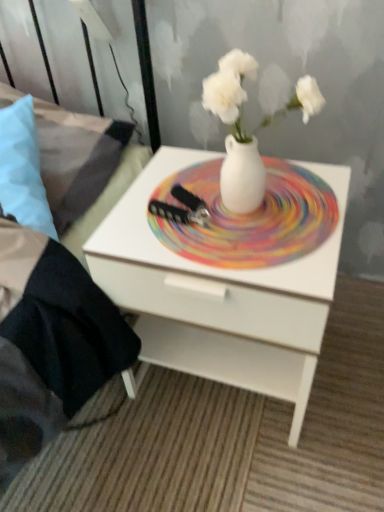
Image resolution: width=384 pixels, height=512 pixels. I want to click on white glossy nightstand at center, so click(x=219, y=296).

Locate an element on the screen. white matte vase at center is located at coordinates (236, 133).

The image size is (384, 512). What do you see at coordinates (236, 133) in the screenshot?
I see `white matte vase at center` at bounding box center [236, 133].

Describe the element at coordinates (250, 218) in the screenshot. The height and width of the screenshot is (512, 384). I see `white glossy plate at center` at that location.

The image size is (384, 512). Describe the element at coordinates (81, 172) in the screenshot. I see `brushed metal bed frame at left` at that location.

This screenshot has width=384, height=512. Identify the location of light blue fabric pillow at left. (23, 169).

In terms of width, does white matte vase at center look wider or thinner when compared to brushed metal bed frame at left?

white matte vase at center is thinner than brushed metal bed frame at left.

Looking at the image, does white matte vase at center seem bigger or smaller compared to brushed metal bed frame at left?

Considering their sizes, white matte vase at center takes up less space than brushed metal bed frame at left.

From a real-world perspective, is white matte vase at center located higher than brushed metal bed frame at left?

Yes, from a real-world perspective, white matte vase at center is above brushed metal bed frame at left.

Who is shorter, white matte vase at center or brushed metal bed frame at left?

With less height is white matte vase at center.

From their relative heights in the image, would you say brushed metal bed frame at left is taller or shorter than light blue fabric pillow at left?

brushed metal bed frame at left is taller than light blue fabric pillow at left.

Does brushed metal bed frame at left have a lesser width compared to light blue fabric pillow at left?

No.

From the image's perspective, relative to light blue fabric pillow at left, is brushed metal bed frame at left above or below?

Clearly, from the image's perspective, brushed metal bed frame at left is above light blue fabric pillow at left.

Is light blue fabric pillow at left surrounded by brushed metal bed frame at left?

Yes, light blue fabric pillow at left is a part of brushed metal bed frame at left.

Is white glossy plate at center at the back of white matte vase at center?

That's not correct — white matte vase at center is not looking away from white glossy plate at center.

From the image's perspective, is white matte vase at center positioned above or below white glossy plate at center?

white matte vase at center is above white glossy plate at center.

Can you tell me how much white matte vase at center and white glossy plate at center differ in facing direction?

The facing directions of white matte vase at center and white glossy plate at center are 1.07 degrees apart.

Which of these two, white glossy plate at center or white matte vase at center, stands shorter?

Standing shorter between the two is white glossy plate at center.

Looking at this image, between white glossy plate at center and white matte vase at center, which one has larger size?

white matte vase at center.

In terms of width, does white glossy plate at center look wider or thinner when compared to white matte vase at center?

In the image, white glossy plate at center appears to be wider than white matte vase at center.

Find the location of a particular element. This screenshot has height=512, width=384. plate on the left of white matte vase at center is located at coordinates (250, 218).

Is light blue fabric pillow at left oriented towards white glossy plate at center?

No.

Which object is thinner, light blue fabric pillow at left or white glossy plate at center?

Thinner between the two is light blue fabric pillow at left.

Which of these two, light blue fabric pillow at left or white glossy plate at center, is bigger?

With larger size is light blue fabric pillow at left.

Would you say light blue fabric pillow at left is inside or outside white glossy plate at center?

light blue fabric pillow at left exists outside the volume of white glossy plate at center.

Is brushed metal bed frame at left in front of or behind white glossy plate at center in the image?

brushed metal bed frame at left is positioned closer to the viewer than white glossy plate at center.

Which of these two, brushed metal bed frame at left or white glossy plate at center, stands shorter?

white glossy plate at center.

Can you tell me how much brushed metal bed frame at left and white glossy plate at center differ in facing direction?

The angle between the facing direction of brushed metal bed frame at left and the facing direction of white glossy plate at center is 4.67 degrees.

Identify the location of bed frame on the left of the white glossy plate at center. (81, 172).

How different are the orientations of white glossy nightstand at center and brushed metal bed frame at left in degrees?

The angular difference between white glossy nightstand at center and brushed metal bed frame at left is 4.67 degrees.

Can you confirm if white glossy nightstand at center is shorter than brushed metal bed frame at left?

In fact, white glossy nightstand at center may be taller than brushed metal bed frame at left.

Is there a large distance between white glossy nightstand at center and brushed metal bed frame at left?

Actually, white glossy nightstand at center and brushed metal bed frame at left are a little close together.

From a real-world perspective, is white glossy nightstand at center above or below brushed metal bed frame at left?

white glossy nightstand at center is situated lower than brushed metal bed frame at left in the real world.

Find the location of `floral arrangement that appears above the brushed metal bed frame at left (from a real-world perspective)`. floral arrangement that appears above the brushed metal bed frame at left (from a real-world perspective) is located at coordinates (236, 133).

Locate an element on the screen. Image resolution: width=384 pixels, height=512 pixels. bed frame in front of the light blue fabric pillow at left is located at coordinates (81, 172).

From the image, which object appears to be nearer to brushed metal bed frame at left, light blue fabric pillow at left or white glossy nightstand at center?

light blue fabric pillow at left is positioned closer to the anchor brushed metal bed frame at left.

Which object lies nearer to the anchor point white glossy nightstand at center, white glossy plate at center or brushed metal bed frame at left?

white glossy plate at center lies closer to white glossy nightstand at center than the other object.

Based on the photo, estimate the real-world distances between objects in this image. Which object is further from white glossy nightstand at center, brushed metal bed frame at left or white glossy plate at center?

Among the two, brushed metal bed frame at left is located further to white glossy nightstand at center.

Estimate the real-world distances between objects in this image. Which object is further from white glossy plate at center, brushed metal bed frame at left or light blue fabric pillow at left?

light blue fabric pillow at left is further to white glossy plate at center.

Based on their spatial positions, is white glossy plate at center or white matte vase at center closer to white glossy nightstand at center?

Based on the image, white glossy plate at center appears to be nearer to white glossy nightstand at center.

Which object lies nearer to the anchor point brushed metal bed frame at left, white glossy nightstand at center or white glossy plate at center?

Among the two, white glossy nightstand at center is located nearer to brushed metal bed frame at left.

Considering their positions, is brushed metal bed frame at left positioned closer to white matte vase at center than white glossy plate at center?

Among the two, white glossy plate at center is located nearer to white matte vase at center.

When comparing their distances from white glossy plate at center, does white glossy nightstand at center or white matte vase at center seem further?

white glossy nightstand at center is further to white glossy plate at center.

This screenshot has height=512, width=384. Find the location of `plate situated between brushed metal bed frame at left and white matte vase at center from left to right`. plate situated between brushed metal bed frame at left and white matte vase at center from left to right is located at coordinates (250, 218).

The width and height of the screenshot is (384, 512). I want to click on nightstand located between light blue fabric pillow at left and white glossy plate at center in the left-right direction, so pos(219,296).

Where is `pillow located between brushed metal bed frame at left and white matte vase at center in the left-right direction`? This screenshot has width=384, height=512. pillow located between brushed metal bed frame at left and white matte vase at center in the left-right direction is located at coordinates (23, 169).

The width and height of the screenshot is (384, 512). What are the coordinates of `nightstand located between brushed metal bed frame at left and white glossy plate at center in the left-right direction` in the screenshot? It's located at (219, 296).